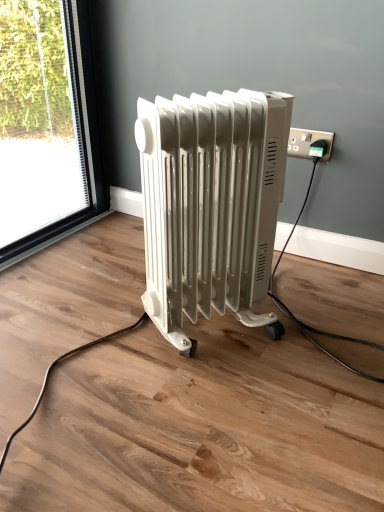
Question: Looking at the image, does white glossy radiator at center seem bigger or smaller compared to green plastic plug at upper right?

Choices:
 (A) big
 (B) small

Answer: (A)

Question: Considering their positions, is white glossy radiator at center located in front of or behind green plastic plug at upper right?

Choices:
 (A) behind
 (B) front

Answer: (B)

Question: In the image, is white glossy radiator at center on the left side or the right side of green plastic plug at upper right?

Choices:
 (A) right
 (B) left

Answer: (B)

Question: Is point (304, 148) positioned closer to the camera than point (200, 193)?

Choices:
 (A) farther
 (B) closer

Answer: (A)

Question: Is green plastic plug at upper right inside or outside of white glossy radiator at center?

Choices:
 (A) outside
 (B) inside

Answer: (A)

Question: In terms of width, does green plastic plug at upper right look wider or thinner when compared to white glossy radiator at center?

Choices:
 (A) thin
 (B) wide

Answer: (A)

Question: Considering the positions of green plastic plug at upper right and white glossy radiator at center in the image, is green plastic plug at upper right taller or shorter than white glossy radiator at center?

Choices:
 (A) tall
 (B) short

Answer: (B)